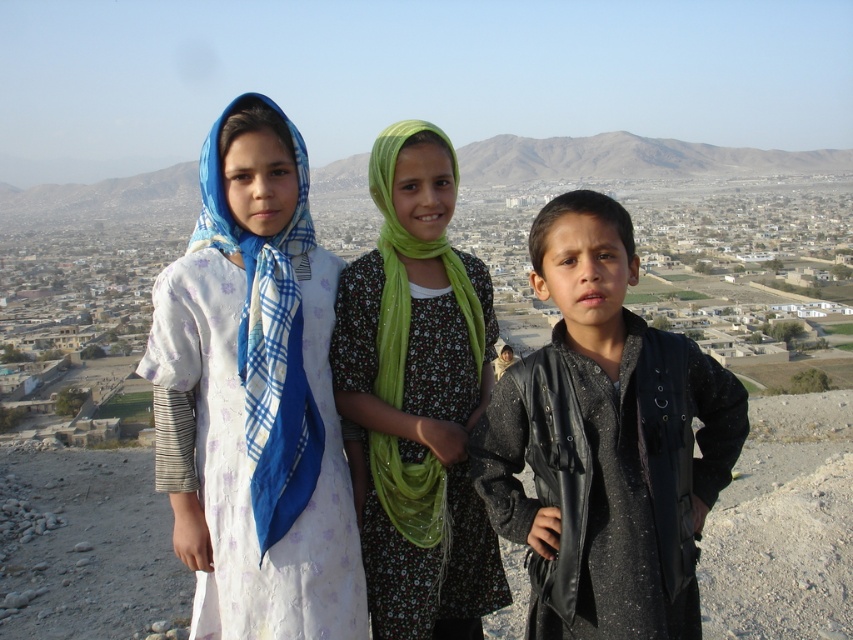
Looking at this image, does white floral dress at center have a lesser height compared to green fabric scarf at center?

No.

This screenshot has height=640, width=853. What do you see at coordinates (260, 392) in the screenshot?
I see `white floral dress at center` at bounding box center [260, 392].

Is point (281, 552) in front of point (434, 324)?

Yes, point (281, 552) is closer to viewer.

Where is `white floral dress at center`? The image size is (853, 640). white floral dress at center is located at coordinates (260, 392).

Does black leather jacket at center appear under rugged brown hill at upper center?

Indeed, black leather jacket at center is positioned under rugged brown hill at upper center.

Is point (711, 432) positioned in front of point (610, 145)?

Yes, it is in front of point (610, 145).

Describe the element at coordinates (605, 442) in the screenshot. I see `black leather jacket at center` at that location.

The width and height of the screenshot is (853, 640). I want to click on black leather jacket at center, so click(605, 442).

Is green fabric scarf at center to the right of rugged brown hill at upper center from the viewer's perspective?

Indeed, green fabric scarf at center is positioned on the right side of rugged brown hill at upper center.

Who is shorter, green fabric scarf at center or rugged brown hill at upper center?

green fabric scarf at center is shorter.

Is point (434, 580) positioned in front of point (645, 154)?

Yes, it is.

Find the location of a particular element. Image resolution: width=853 pixels, height=640 pixels. green fabric scarf at center is located at coordinates (418, 396).